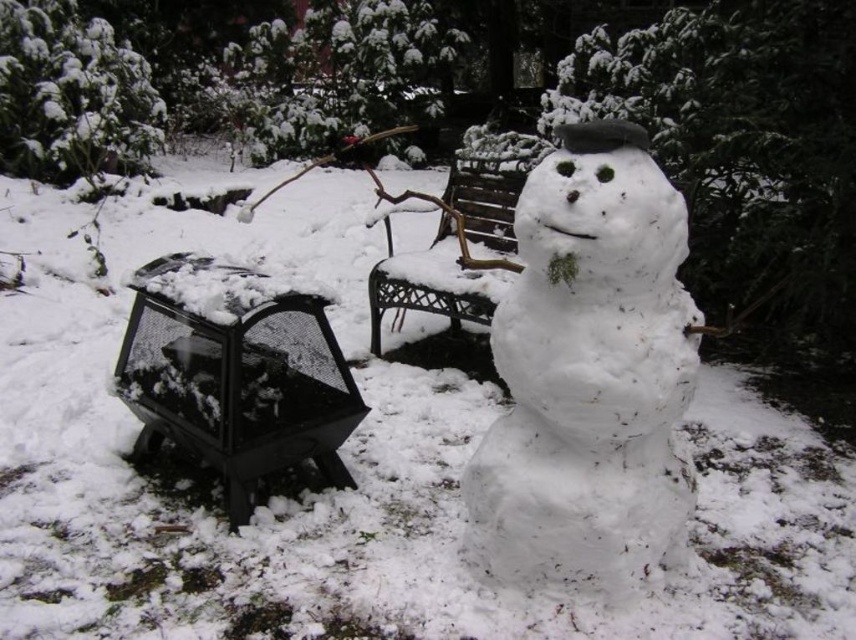
The image size is (856, 640). Describe the element at coordinates (589, 372) in the screenshot. I see `white fluffy snowman at center` at that location.

Can you confirm if white fluffy snowman at center is smaller than metallic brown bench at center?

Correct, white fluffy snowman at center occupies less space than metallic brown bench at center.

Is point (681, 365) positioned behind point (428, 289)?

No, (681, 365) is closer to viewer.

Find the location of `white fluffy snowman at center`. white fluffy snowman at center is located at coordinates (589, 372).

Between white fluffy snowman at center and black mesh fire pit at lower left, which one appears on the right side from the viewer's perspective?

white fluffy snowman at center is more to the right.

Is white fluffy snowman at center shorter than black mesh fire pit at lower left?

Incorrect, white fluffy snowman at center's height does not fall short of black mesh fire pit at lower left's.

Who is more distant from viewer, [614,374] or [158,417]?

The point [158,417] is more distant.

At what (x,y) coordinates should I click in order to perform the action: click on white fluffy snowman at center. Please return your answer as a coordinate pair (x, y). Image resolution: width=856 pixels, height=640 pixels. Looking at the image, I should click on (589, 372).

Does black mesh fire pit at lower left appear over metallic brown bench at center?

Incorrect, black mesh fire pit at lower left is not positioned above metallic brown bench at center.

The image size is (856, 640). What do you see at coordinates (241, 388) in the screenshot?
I see `black mesh fire pit at lower left` at bounding box center [241, 388].

What do you see at coordinates (241, 388) in the screenshot?
I see `black mesh fire pit at lower left` at bounding box center [241, 388].

Where is `black mesh fire pit at lower left`? black mesh fire pit at lower left is located at coordinates (241, 388).